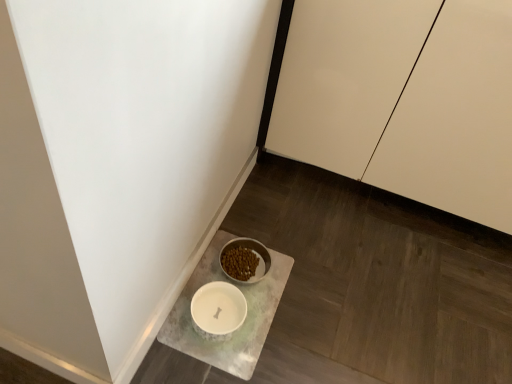
Question: From the image's perspective, is white matte cabinet at upper right below white marble tray at lower center?

Choices:
 (A) no
 (B) yes

Answer: (A)

Question: Is white matte cabinet at upper right facing away from white marble tray at lower center?

Choices:
 (A) no
 (B) yes

Answer: (A)

Question: Is white marble tray at lower center located within white matte cabinet at upper right?

Choices:
 (A) no
 (B) yes

Answer: (A)

Question: From a real-world perspective, does white matte cabinet at upper right stand above white marble tray at lower center?

Choices:
 (A) no
 (B) yes

Answer: (B)

Question: Could you tell me if white matte cabinet at upper right is facing white marble tray at lower center?

Choices:
 (A) no
 (B) yes

Answer: (B)

Question: Does white matte cabinet at upper right lie in front of white marble tray at lower center?

Choices:
 (A) no
 (B) yes

Answer: (B)

Question: From the image's perspective, is white marble tray at lower center below white matte cabinet at upper right?

Choices:
 (A) yes
 (B) no

Answer: (A)

Question: Can you confirm if white marble tray at lower center is wider than white matte cabinet at upper right?

Choices:
 (A) no
 (B) yes

Answer: (A)

Question: Considering the relative positions of white marble tray at lower center and white matte cabinet at upper right in the image provided, is white marble tray at lower center to the right of white matte cabinet at upper right from the viewer's perspective?

Choices:
 (A) no
 (B) yes

Answer: (A)

Question: From the image's perspective, is white marble tray at lower center above white matte cabinet at upper right?

Choices:
 (A) yes
 (B) no

Answer: (B)

Question: Considering the relative sizes of white marble tray at lower center and white matte cabinet at upper right in the image provided, is white marble tray at lower center thinner than white matte cabinet at upper right?

Choices:
 (A) yes
 (B) no

Answer: (A)

Question: Can white matte cabinet at upper right be found inside white marble tray at lower center?

Choices:
 (A) no
 (B) yes

Answer: (A)

Question: Is white marble tray at lower center spatially inside white matte cabinet at upper right, or outside of it?

Choices:
 (A) inside
 (B) outside

Answer: (B)